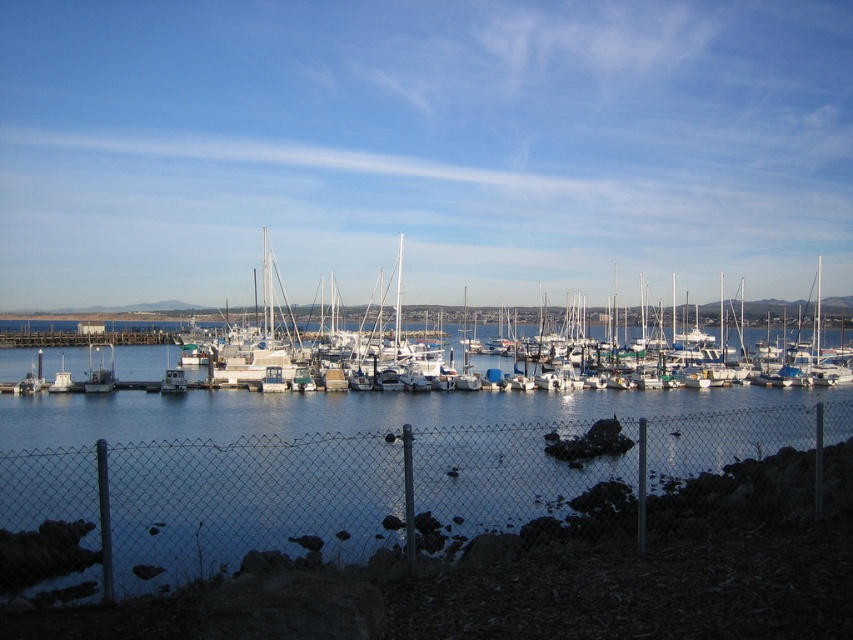
Is metallic gray boat at left further to the viewer compared to white matte boat at left?

No, it is in front of white matte boat at left.

Is point (100, 376) more distant than point (62, 392)?

Yes, point (100, 376) is behind point (62, 392).

Locate an element on the screen. metallic gray boat at left is located at coordinates click(x=99, y=371).

Can you confirm if white matte boats at center is positioned to the left of metallic gray boat at left?

Incorrect, white matte boats at center is not on the left side of metallic gray boat at left.

Which is behind, point (247, 332) or point (86, 387)?

Point (247, 332)

Where is `white matte boats at center`? The width and height of the screenshot is (853, 640). white matte boats at center is located at coordinates (370, 321).

Does point (35, 582) come closer to viewer compared to point (102, 372)?

Yes, it is in front of point (102, 372).

What do you see at coordinates (403, 493) in the screenshot? The image size is (853, 640). I see `metal chain-link fence at lower center` at bounding box center [403, 493].

Which is in front, point (120, 582) or point (97, 376)?

Point (120, 582) is in front.

The width and height of the screenshot is (853, 640). Identify the location of metal chain-link fence at lower center. (403, 493).